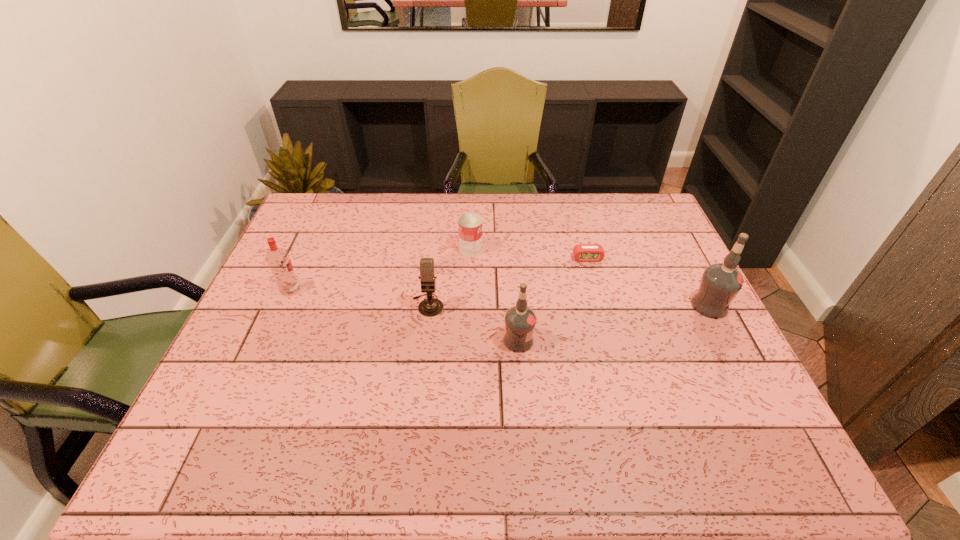
Find the location of a particular element. free space between the third object from left to right and the rightmost vodka is located at coordinates (590, 278).

At what (x,y) coordinates should I click in order to perform the action: click on blank region between the second object from left to right and the tallest object. Please return your answer as a coordinate pair (x, y). This screenshot has height=540, width=960. Looking at the image, I should click on (568, 305).

Where is `vacant area that lies between the rightmost vodka and the fourth object from left to right`? This screenshot has width=960, height=540. vacant area that lies between the rightmost vodka and the fourth object from left to right is located at coordinates (614, 323).

You are a GUI agent. You are given a task and a screenshot of the screen. Output one action in this format:
    pyautogui.click(x=<x>, y=<y>)
    Task: Click on the free space between the nearest vodka and the rightmost vodka
    The image size is (960, 540).
    Given the screenshot: What is the action you would take?
    pyautogui.click(x=614, y=323)

Identify which object is the second closest to the alarm clock. Please provide its 2D coordinates. Your answer should be formatted as a tuple, i.e. [(x, y)], where the tuple contains the x and y coordinates of a point satisfying the conditions above.

[(469, 225)]

Identify which object is located as the third nearest to the shortest object. Please provide its 2D coordinates. Your answer should be formatted as a tuple, i.e. [(x, y)], where the tuple contains the x and y coordinates of a point satisfying the conditions above.

[(520, 320)]

Identify which vodka is the third closest to the alarm clock. Please provide its 2D coordinates. Your answer should be formatted as a tuple, i.e. [(x, y)], where the tuple contains the x and y coordinates of a point satisfying the conditions above.

[(278, 259)]

Identify the location of vodka that is the third closest to the can. tap(720, 283).

Where is `free location that satisfies the following two spatial constraints: 1. on the front-facing side of the shortest object; 2. on the front label of the nearest vodka`? The image size is (960, 540). free location that satisfies the following two spatial constraints: 1. on the front-facing side of the shortest object; 2. on the front label of the nearest vodka is located at coordinates (610, 340).

The width and height of the screenshot is (960, 540). Find the location of `vacant region that satisfies the following two spatial constraints: 1. on the front-facing side of the shortest object; 2. on the front label of the leftmost vodka`. vacant region that satisfies the following two spatial constraints: 1. on the front-facing side of the shortest object; 2. on the front label of the leftmost vodka is located at coordinates (596, 290).